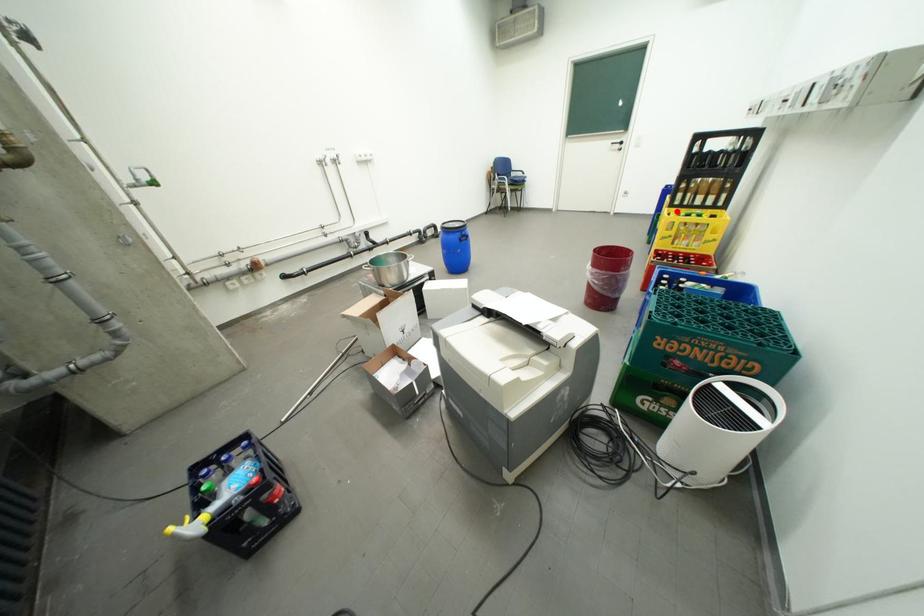
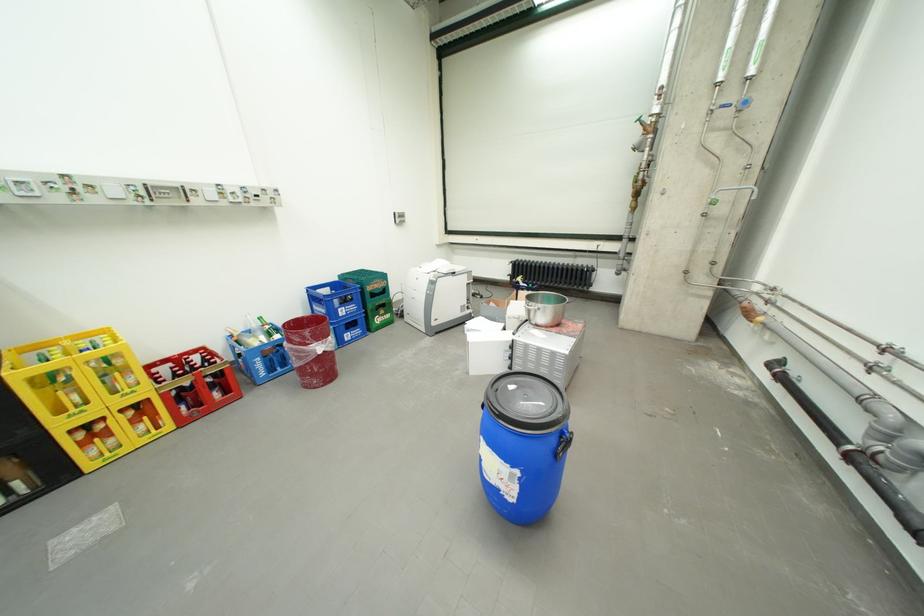
The point at the highlighted location is marked in the first image. Where is the corresponding point in the second image?

(30, 374)